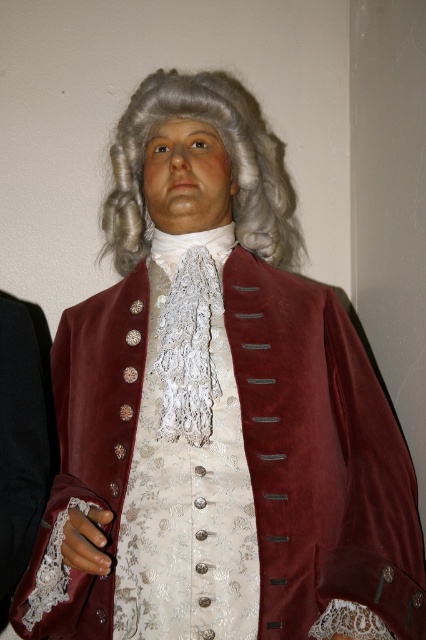
You are a tailor measuring the distance between the white lace dress at center and the grayhair at center for a costume fitting. The minimum required space between them is 10 inches. Is the current distance sufficient?

The white lace dress at center and grayhair at center are 12.04 inches apart, which is more than the required 10 inches, so the current distance is sufficient.

You are a fashion historian examining the image of an 18th century figure. You need to determine the spatial arrangement of the clothing items. Which object is positioned to the left of the other between the white lace dress at center and the grayhair at center?

The white lace dress at center is to the left of grayhair at center according to the description.

From the picture: You are an artist trying to sketch the figure in the image. You need to place the white lace dress at center accurately on your canvas. What are the coordinates where you should position it?

The white lace dress at center should be positioned at coordinates 0.730 on the x axis and 0.441 on the y axis.